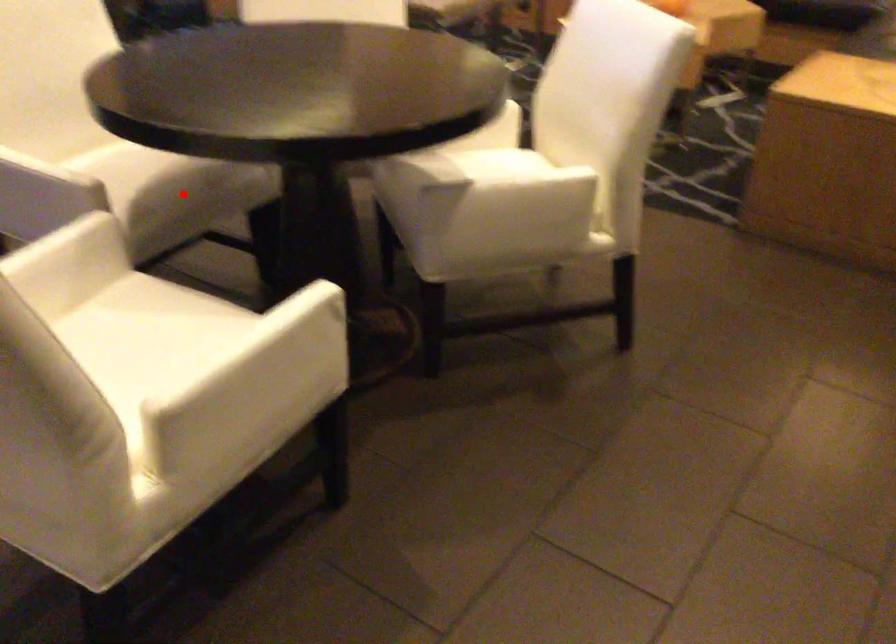
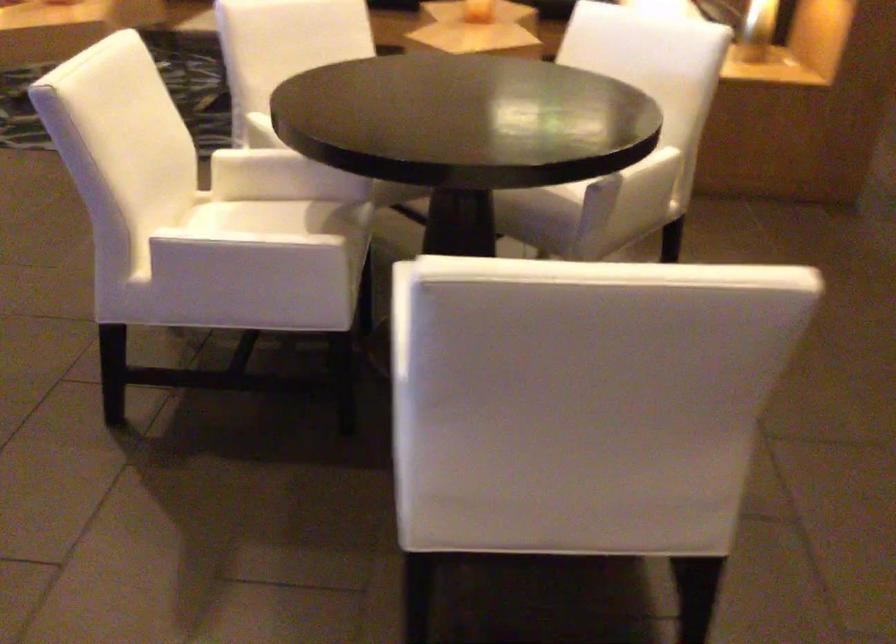
Locate, in the second image, the point that corresponds to the highlighted location in the first image.

(347, 240)